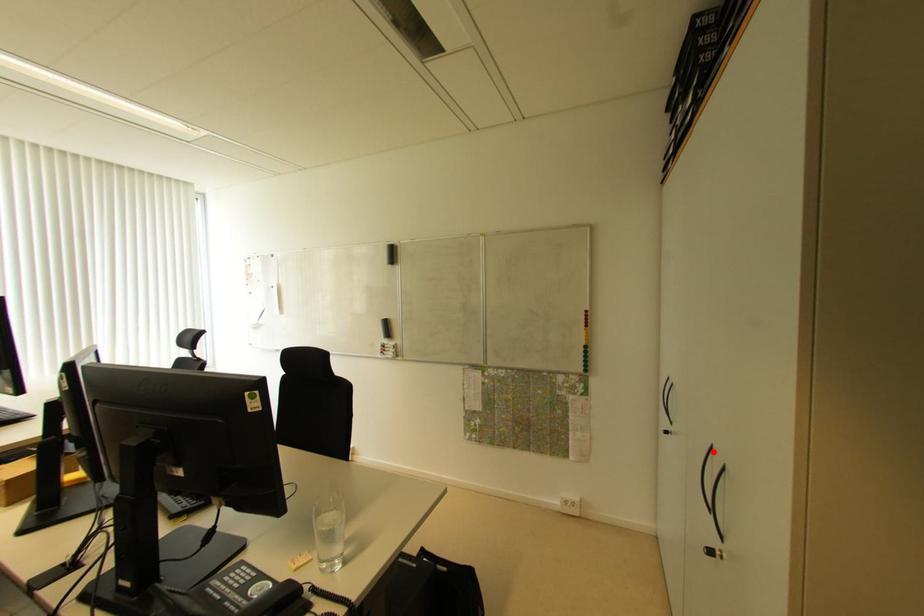
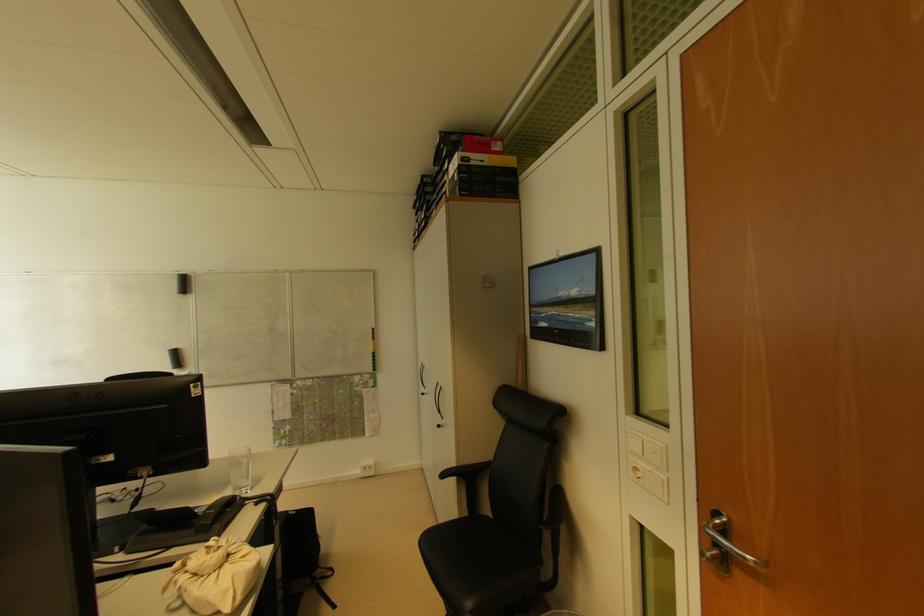
Find the pixel in the second image that matches the highlighted location in the first image.

(440, 387)